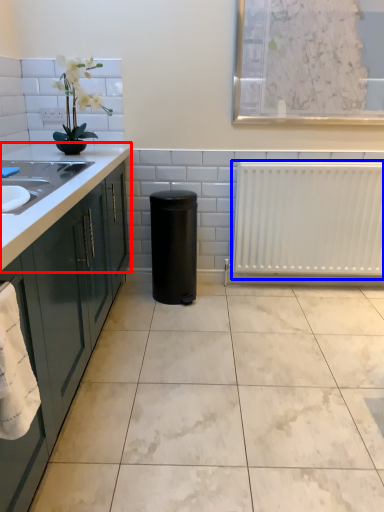
Question: Which of the following is the farthest to the observer, countertop (highlighted by a red box) or radiator (highlighted by a blue box)?

Choices:
 (A) countertop
 (B) radiator

Answer: (B)